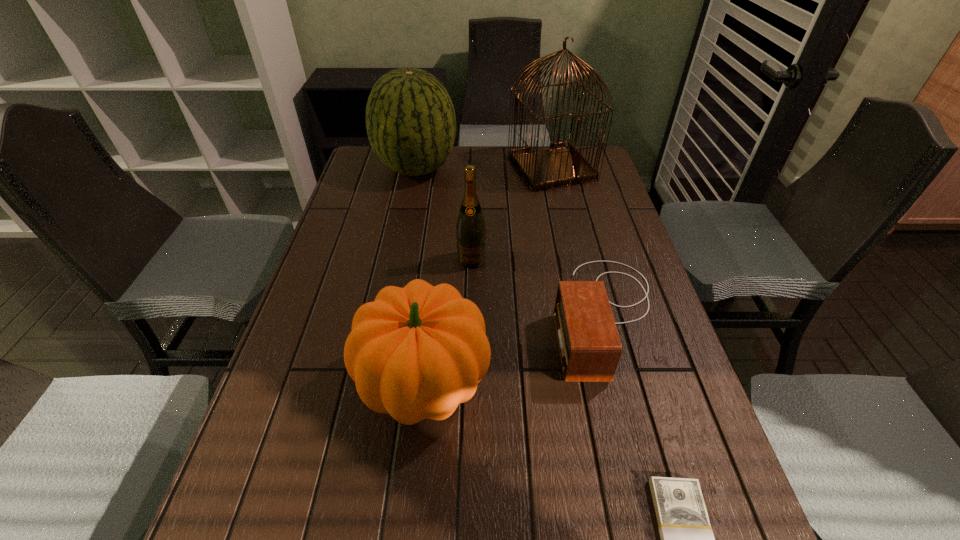
Where is `free space at the left edge of the desktop`? free space at the left edge of the desktop is located at coordinates (389, 214).

Where is `vacant area at the right edge`? vacant area at the right edge is located at coordinates (574, 228).

Find the location of a particular element. This screenshot has height=540, width=960. vacant area at the far left corner is located at coordinates (367, 177).

This screenshot has width=960, height=540. I want to click on vacant space at the far right corner of the desktop, so click(x=604, y=173).

Identify the location of vacant area that lies between the watermelon and the fourth shortest object. (444, 214).

Where is `vacant area between the wine bottle and the birdcage`? vacant area between the wine bottle and the birdcage is located at coordinates (512, 214).

In order to click on vacant space in between the tallest object and the watermelon in this screenshot , I will do `click(484, 168)`.

You are a GUI agent. You are given a task and a screenshot of the screen. Output one action in this format:
    pyautogui.click(x=<x>, y=<y>)
    Task: Click on the free space between the watermelon and the fourth shortest object
    The width and height of the screenshot is (960, 540).
    Given the screenshot: What is the action you would take?
    pyautogui.click(x=444, y=214)

What are the coordinates of `free space that is in between the tallest object and the fourth tallest object` in the screenshot? It's located at (489, 276).

Find the location of a particular element. The width and height of the screenshot is (960, 540). free space between the watermelon and the second shortest object is located at coordinates (511, 242).